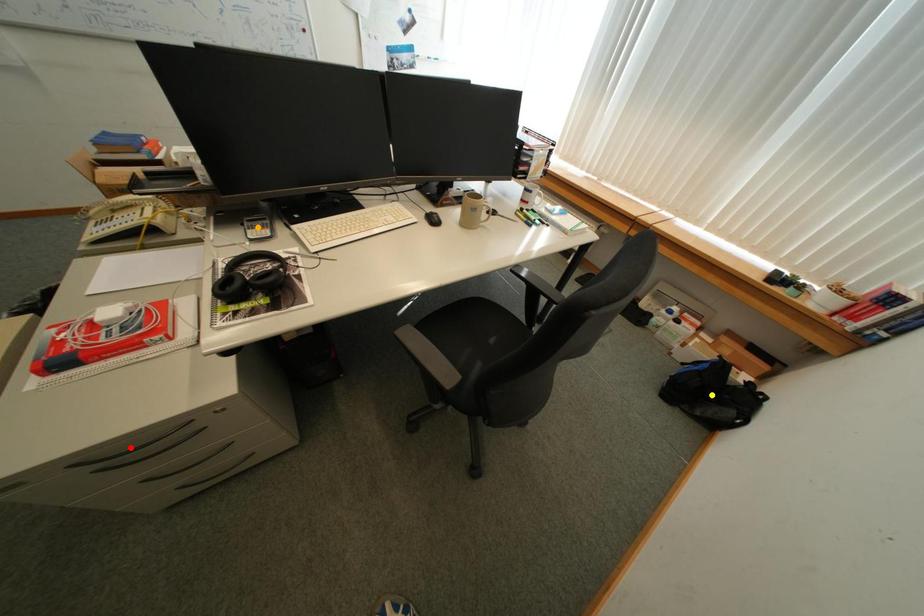
Order these from nearest to farthest:
orange point | red point | yellow point

red point
orange point
yellow point